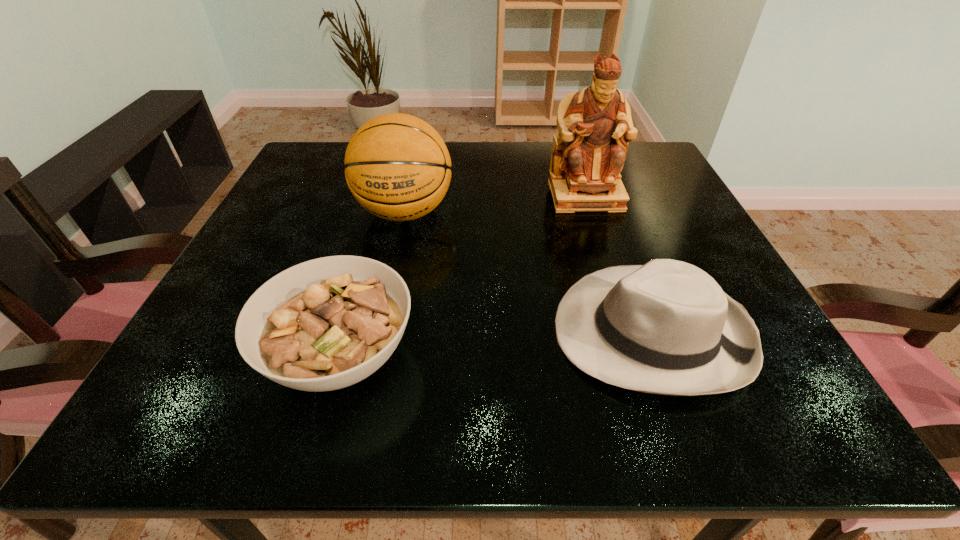
The image size is (960, 540). What are the coordinates of `vacant space at the far edge of the desktop` in the screenshot? It's located at tap(452, 148).

Locate an element on the screen. The height and width of the screenshot is (540, 960). vacant space at the near edge of the desktop is located at coordinates (501, 390).

Locate an element on the screen. This screenshot has width=960, height=540. free spot at the left edge of the desktop is located at coordinates (270, 250).

Find the location of a particular element. This screenshot has height=540, width=960. vacant space at the right edge of the desktop is located at coordinates (646, 217).

Where is `free space that is in between the fedora and the stew`? This screenshot has height=540, width=960. free space that is in between the fedora and the stew is located at coordinates 496,344.

At what (x,y) coordinates should I click in order to perform the action: click on free spot between the third shortest object and the figurine. Please return your answer as a coordinate pair (x, y). Looking at the image, I should click on pyautogui.click(x=495, y=204).

Locate an element on the screen. blank region between the fedora and the second tallest object is located at coordinates (528, 272).

This screenshot has height=540, width=960. I want to click on empty space between the fedora and the figurine, so click(618, 264).

The image size is (960, 540). Find the location of `vacant space that is in between the stew and the tallest object`. vacant space that is in between the stew and the tallest object is located at coordinates (464, 275).

Find the location of `blank region between the fedora and the stew`. blank region between the fedora and the stew is located at coordinates (496, 344).